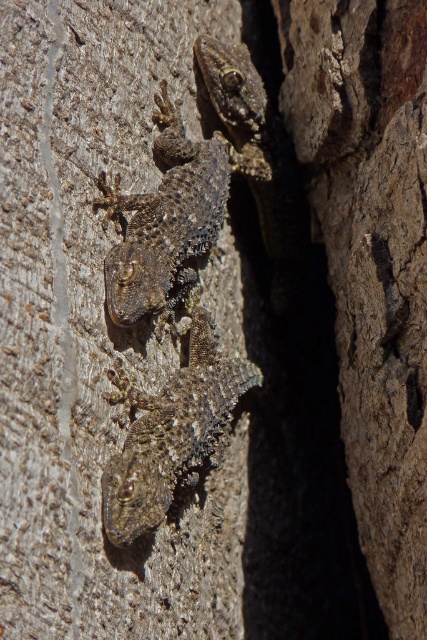
Between rough textured lizard at center and scaly brown lizard at center, which one appears on the right side from the viewer's perspective?

rough textured lizard at center

You are a GUI agent. You are given a task and a screenshot of the screen. Output one action in this format:
    pyautogui.click(x=<x>, y=<y>)
    Task: Click on the rough textured lizard at center
    The image size is (427, 640).
    Given the screenshot: What is the action you would take?
    pyautogui.click(x=172, y=433)